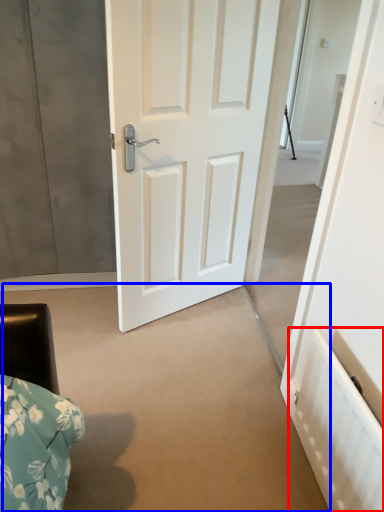
Question: Which object appears farthest to the camera in this image, radiator (highlighted by a red box) or concrete (highlighted by a blue box)?

Choices:
 (A) radiator
 (B) concrete

Answer: (B)